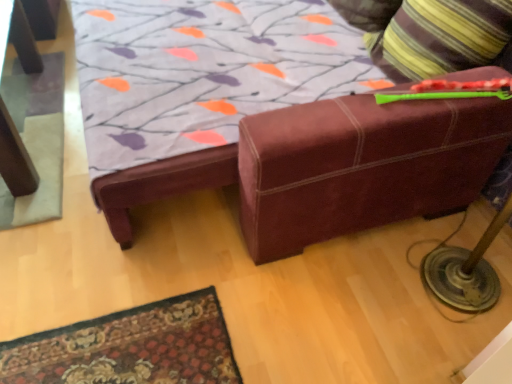
Question: From a real-world perspective, is gray felt mat at left physically below striped fabric pillow at upper right?

Choices:
 (A) yes
 (B) no

Answer: (A)

Question: Is the position of gray felt mat at left more distant than that of striped fabric pillow at upper right?

Choices:
 (A) yes
 (B) no

Answer: (A)

Question: From the image's perspective, would you say gray felt mat at left is positioned over striped fabric pillow at upper right?

Choices:
 (A) yes
 (B) no

Answer: (B)

Question: Is gray felt mat at left looking in the opposite direction of striped fabric pillow at upper right?

Choices:
 (A) no
 (B) yes

Answer: (A)

Question: Is gray felt mat at left oriented towards striped fabric pillow at upper right?

Choices:
 (A) no
 (B) yes

Answer: (A)

Question: Is striped fabric pillow at upper right inside gray felt mat at left?

Choices:
 (A) no
 (B) yes

Answer: (A)

Question: Does striped fabric pillow at upper right appear on the right side of gray felt mat at left?

Choices:
 (A) yes
 (B) no

Answer: (A)

Question: Considering the relative sizes of striped fabric pillow at upper right and gray felt mat at left in the image provided, is striped fabric pillow at upper right bigger than gray felt mat at left?

Choices:
 (A) yes
 (B) no

Answer: (A)

Question: Is striped fabric pillow at upper right further to the viewer compared to gray felt mat at left?

Choices:
 (A) yes
 (B) no

Answer: (B)

Question: Is striped fabric pillow at upper right to the left of gray felt mat at left from the viewer's perspective?

Choices:
 (A) no
 (B) yes

Answer: (A)

Question: From the image's perspective, is striped fabric pillow at upper right beneath gray felt mat at left?

Choices:
 (A) no
 (B) yes

Answer: (A)

Question: Can we say striped fabric pillow at upper right lies outside gray felt mat at left?

Choices:
 (A) no
 (B) yes

Answer: (B)

Question: Choose the correct answer: Is striped fabric pillow at upper right inside gray felt mat at left or outside it?

Choices:
 (A) inside
 (B) outside

Answer: (B)